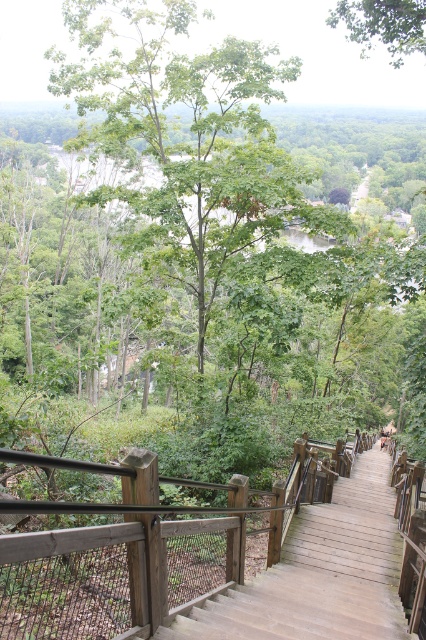
Can you confirm if wooden stairs at center is smaller than green leafy tree at upper center?

Yes, wooden stairs at center is smaller than green leafy tree at upper center.

Does wooden stairs at center have a greater height compared to green leafy tree at upper center?

No, wooden stairs at center is not taller than green leafy tree at upper center.

The image size is (426, 640). What do you see at coordinates (319, 572) in the screenshot?
I see `wooden stairs at center` at bounding box center [319, 572].

Find the location of a particular element. wooden stairs at center is located at coordinates (319, 572).

Based on the photo, can you confirm if green leafy tree at center is taller than green leafy tree at upper center?

No.

Which is more to the right, green leafy tree at center or green leafy tree at upper center?

Positioned to the right is green leafy tree at upper center.

Where is `green leafy tree at center`? green leafy tree at center is located at coordinates (192, 132).

The width and height of the screenshot is (426, 640). What are the coordinates of `green leafy tree at center` in the screenshot? It's located at (192, 132).

Is green leafy tree at center above wooden stairs at center?

Yes.

Is green leafy tree at center wider than wooden stairs at center?

Indeed, green leafy tree at center has a greater width compared to wooden stairs at center.

This screenshot has height=640, width=426. In order to click on green leafy tree at center in this screenshot , I will do `click(192, 132)`.